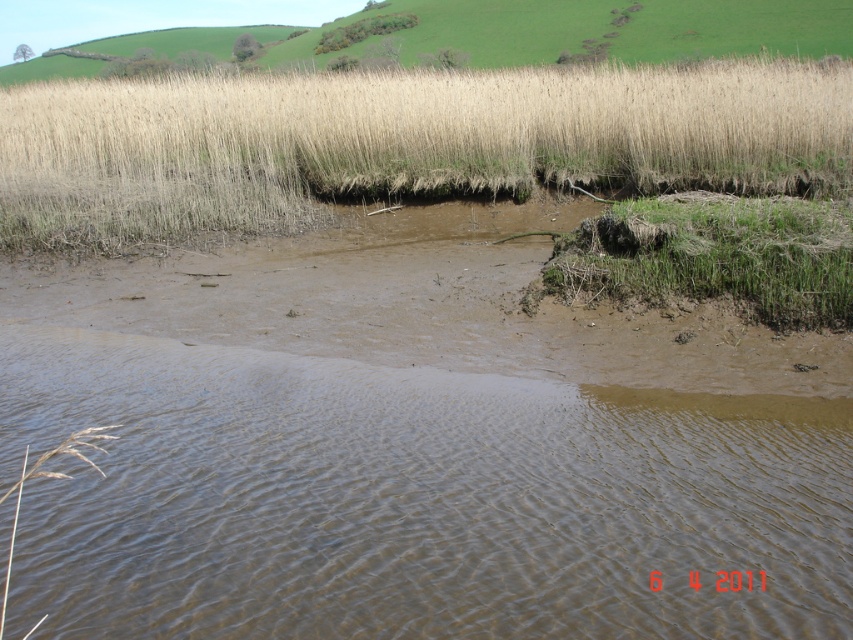
Question: Which of the following is the farthest from the observer?

Choices:
 (A) (648, 26)
 (B) (225, 108)

Answer: (A)

Question: Can you confirm if dry grass at upper center is bigger than golden straw grass at upper center?

Choices:
 (A) no
 (B) yes

Answer: (A)

Question: Estimate the real-world distances between objects in this image. Which object is closer to the dry grass at upper center?

Choices:
 (A) green grassy patch at lower right
 (B) golden straw grass at upper center

Answer: (A)

Question: Which point appears closest to the camera in this image?

Choices:
 (A) (514, 189)
 (B) (91, 45)
 (C) (793, 220)

Answer: (C)

Question: Is dry grass at upper center thinner than green grassy patch at lower right?

Choices:
 (A) yes
 (B) no

Answer: (B)

Question: Where is dry grass at upper center located in relation to golden straw grass at upper center in the image?

Choices:
 (A) below
 (B) above

Answer: (A)